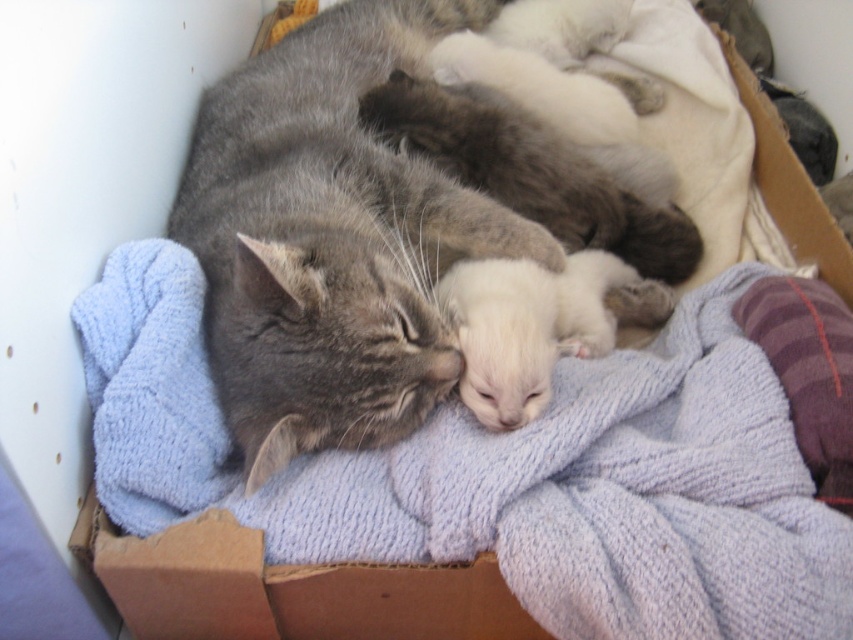
Question: Where is light blue knitted blanket at center located in relation to cardboard box at lower left in the image?

Choices:
 (A) right
 (B) left

Answer: (A)

Question: Is light blue knitted blanket at center further to camera compared to cardboard box at lower left?

Choices:
 (A) yes
 (B) no

Answer: (B)

Question: Among these objects, which one is nearest to the camera?

Choices:
 (A) light blue knitted blanket at center
 (B) cardboard box at lower left

Answer: (A)

Question: Estimate the real-world distances between objects in this image. Which object is farther from the gray tabby cat at center?

Choices:
 (A) light blue knitted blanket at center
 (B) cardboard box at lower left
 (C) white soft kitten at center

Answer: (B)

Question: Estimate the real-world distances between objects in this image. Which object is closer to the cardboard box at lower left?

Choices:
 (A) white soft kitten at center
 (B) light blue knitted blanket at center

Answer: (B)

Question: Can you confirm if light blue knitted blanket at center is positioned to the left of gray tabby cat at center?

Choices:
 (A) yes
 (B) no

Answer: (B)